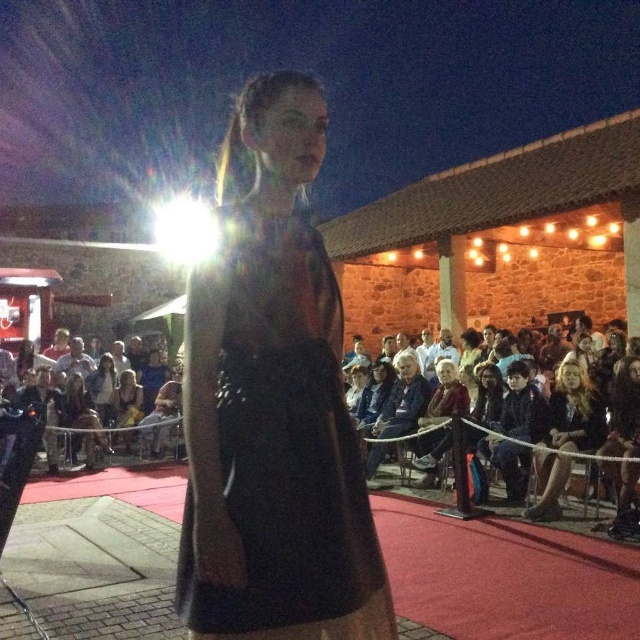
Can you confirm if blonde hair at right is wider than dark blue fabric jacket at lower right?

Indeed, blonde hair at right has a greater width compared to dark blue fabric jacket at lower right.

Is point (573, 451) positioned after point (528, 435)?

No, (573, 451) is in front of (528, 435).

This screenshot has height=640, width=640. Find the location of `blonde hair at right`. blonde hair at right is located at coordinates (573, 412).

Is dark fabric chairs at center thinner than denim jacket at center?

No, dark fabric chairs at center is not thinner than denim jacket at center.

Is dark fabric chairs at center below denim jacket at center?

Actually, dark fabric chairs at center is above denim jacket at center.

Between point (115, 461) and point (397, 406), which one is positioned behind?

Positioned behind is point (115, 461).

Find the location of `dark fabric chairs at center`. dark fabric chairs at center is located at coordinates 116,442.

Who is higher up, blonde hair at right or denim jacket at center?

denim jacket at center

Can you confirm if blonde hair at right is positioned to the left of denim jacket at center?

Incorrect, blonde hair at right is not on the left side of denim jacket at center.

What do you see at coordinates (573, 412) in the screenshot?
I see `blonde hair at right` at bounding box center [573, 412].

At what (x,y) coordinates should I click in order to perform the action: click on blonde hair at right. Please return your answer as a coordinate pair (x, y). This screenshot has height=640, width=640. Looking at the image, I should click on (573, 412).